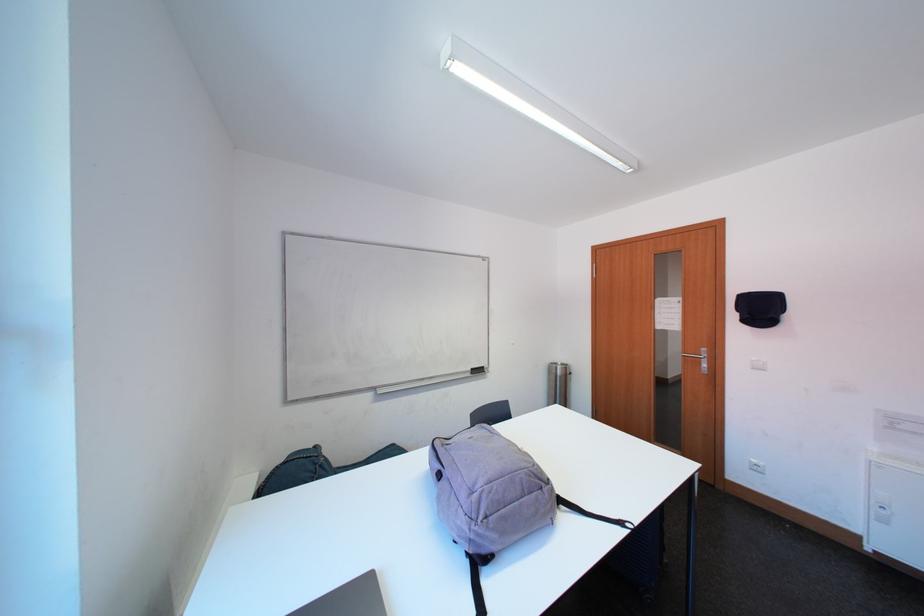
At what (x,y) coordinates should I click in order to perform the action: click on black cap. Please return your answer as a coordinate pair (x, y). This screenshot has height=616, width=924. Looking at the image, I should click on (760, 308).